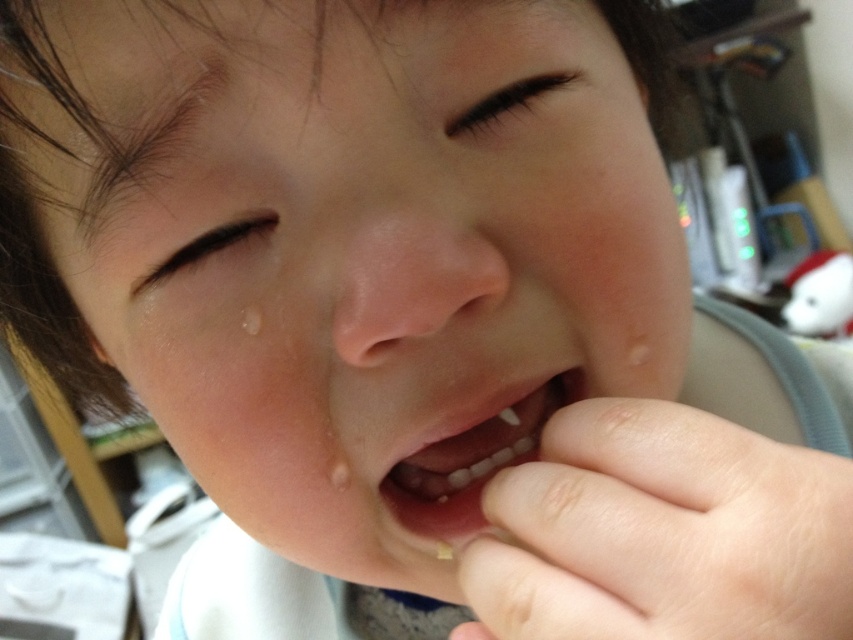
Between pale skin hand at mouth and pink flesh-colored teeth at center, which one appears on the left side from the viewer's perspective?

pink flesh-colored teeth at center is more to the left.

Is point (564, 499) in front of point (438, 540)?

Yes, it is.

Is point (668, 422) positioned after point (403, 508)?

No, it is in front of (403, 508).

You are a GUI agent. You are given a task and a screenshot of the screen. Output one action in this format:
    pyautogui.click(x=<x>, y=<y>)
    Task: Click on the pale skin hand at mouth
    The image size is (853, 640).
    Given the screenshot: What is the action you would take?
    pyautogui.click(x=662, y=532)